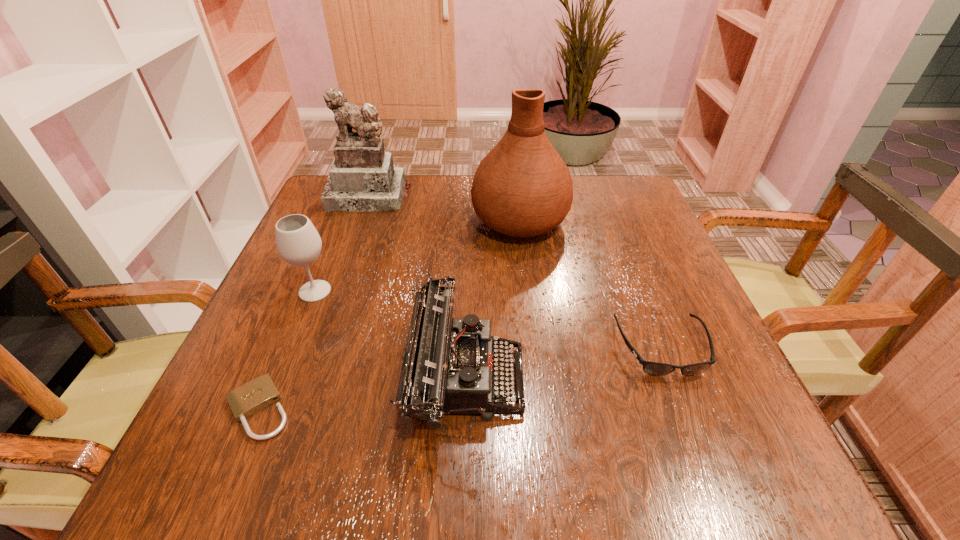
The width and height of the screenshot is (960, 540). What are the coordinates of `object that is the second closest one to the shortest object` in the screenshot? It's located at (449, 365).

At what (x,y) coordinates should I click in order to perform the action: click on vacant position in the image that satisfies the following two spatial constraints: 1. on the keyboard of the fourth tallest object; 2. on the front side of the padlock. Please return your answer as a coordinate pair (x, y). Image resolution: width=960 pixels, height=540 pixels. Looking at the image, I should click on (464, 409).